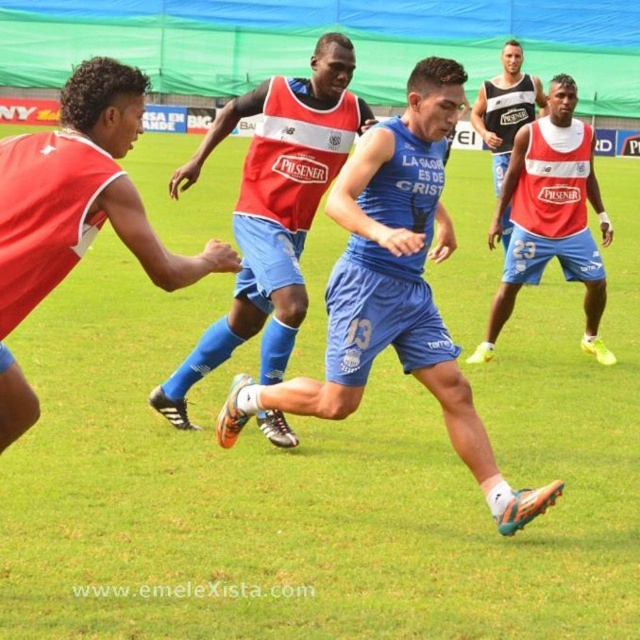
Question: Does matte red jersey at left have a lesser width compared to matte black tank top at upper right?

Choices:
 (A) no
 (B) yes

Answer: (A)

Question: Among these objects, which one is nearest to the camera?

Choices:
 (A) matte red jersey at right
 (B) matte red jersey at left
 (C) matte black tank top at upper right
 (D) matte red jersey at center

Answer: (B)

Question: Observing the image, what is the correct spatial positioning of blue fabric jersey at center in reference to matte red jersey at center?

Choices:
 (A) below
 (B) above

Answer: (A)

Question: Based on their relative distances, which object is farther from the matte red jersey at center?

Choices:
 (A) matte red jersey at right
 (B) blue fabric jersey at center
 (C) matte black tank top at upper right

Answer: (C)

Question: Can you confirm if matte red jersey at center is positioned to the left of matte red jersey at left?

Choices:
 (A) no
 (B) yes

Answer: (A)

Question: Considering the real-world distances, which object is farthest from the matte red jersey at center?

Choices:
 (A) blue fabric jersey at center
 (B) matte red jersey at left
 (C) matte red jersey at right

Answer: (C)